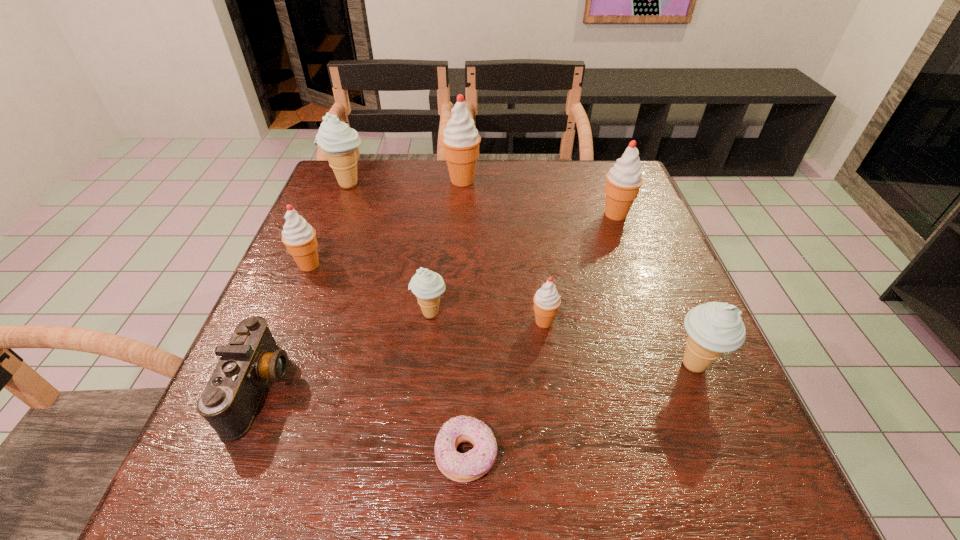
You are a GUI agent. You are given a task and a screenshot of the screen. Output one action in this format:
    pyautogui.click(x=<x>, y=<y>)
    Task: Click on the free space between the biggest beige icecream and the farthest red icecream
    This screenshot has height=540, width=960.
    Given the screenshot: What is the action you would take?
    pyautogui.click(x=405, y=183)

Where is `empty space that is in between the farthest beige icecream and the doughnut`? The image size is (960, 540). empty space that is in between the farthest beige icecream and the doughnut is located at coordinates (407, 320).

You are a GUI agent. You are given a task and a screenshot of the screen. Output one action in this format:
    pyautogui.click(x=<x>, y=<y>)
    Task: Click on the unoccupied area between the leftmost red icecream and the purple doughnut
    This screenshot has width=960, height=540.
    Given the screenshot: What is the action you would take?
    pyautogui.click(x=388, y=360)

What are the coordinates of `vacant space that is in between the doughnut and the rightmost beige icecream` in the screenshot? It's located at (580, 410).

Image resolution: width=960 pixels, height=540 pixels. Find the location of `unoccupied area between the farthest red icecream and the third object from right to left`. unoccupied area between the farthest red icecream and the third object from right to left is located at coordinates (503, 251).

Locate an element on the screen. The width and height of the screenshot is (960, 540). empty location between the third red icecream from left to right and the shortest object is located at coordinates (505, 388).

You are a GUI agent. You are given a task and a screenshot of the screen. Output one action in this format:
    pyautogui.click(x=<x>, y=<y>)
    Task: Click on the empty space that is in between the tallest object and the third nearest red icecream
    This screenshot has width=960, height=540.
    Given the screenshot: What is the action you would take?
    pyautogui.click(x=539, y=197)

Identify the location of object that ranks as the eighth closest to the third farthest object. [231, 398].

Where is `object that is the seventh closest to the smallest beige icecream`? object that is the seventh closest to the smallest beige icecream is located at coordinates (339, 142).

The image size is (960, 540). I want to click on icecream that is the third closest to the nearest beige icecream, so click(x=427, y=285).